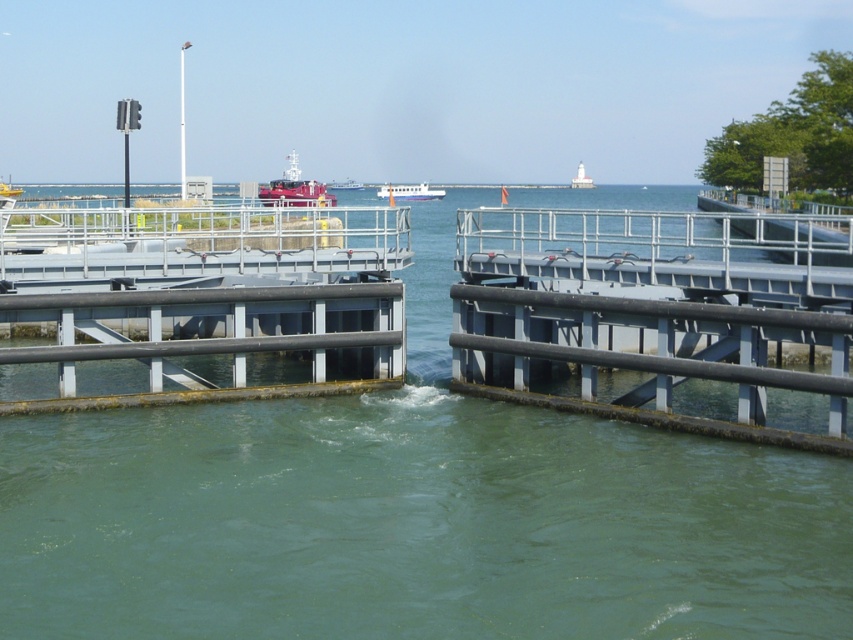
You are a boat operator trying to navigate through the lock system. You see the clear water at center and the white glossy boat at center. Which object is closer to you as you approach the lock?

The clear water at center is in front of the white glossy boat at center, so the clear water at center is closer to you as you approach the lock.

You are a boat operator trying to navigate through the lock system. You see the clear water at center and the white glossy boat at center. Which object is positioned higher in the scene?

The white glossy boat at center is positioned higher than the clear water at center because the clear water at center is below the white glossy boat at center.